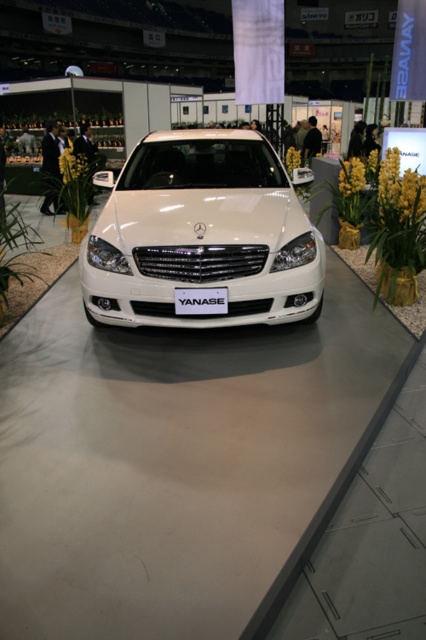
Question: Which point appears farthest from the camera in this image?

Choices:
 (A) (9, 289)
 (B) (152, 163)
 (C) (408, 262)
 (D) (206, 310)

Answer: (A)

Question: Which object is farther from the camera taking this photo?

Choices:
 (A) white plastic license plate at center
 (B) green leafy plant at left

Answer: (B)

Question: Is white glossy car at center closer to camera compared to yellow textured plant at center right?

Choices:
 (A) no
 (B) yes

Answer: (B)

Question: Does green leafy plant at left have a smaller size compared to white plastic license plate at center?

Choices:
 (A) no
 (B) yes

Answer: (A)

Question: Which object is positioned farthest from the yellow textured plant at center right?

Choices:
 (A) white glossy car at center
 (B) green leafy plant at left

Answer: (B)

Question: Does green leafy plant at left have a larger size compared to white plastic license plate at center?

Choices:
 (A) no
 (B) yes

Answer: (B)